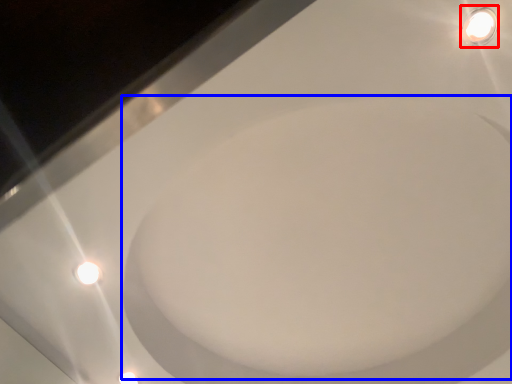
Question: Among these objects, which one is nearest to the camera, light fixture (highlighted by a red box) or bath (highlighted by a blue box)?

Choices:
 (A) light fixture
 (B) bath

Answer: (A)